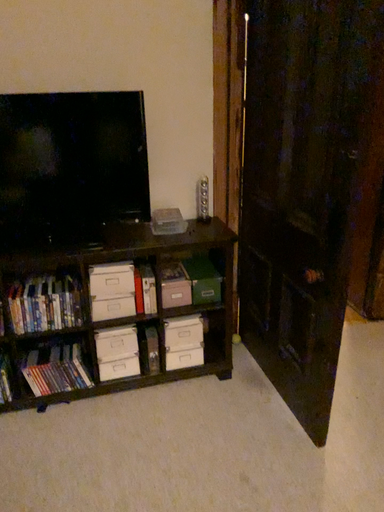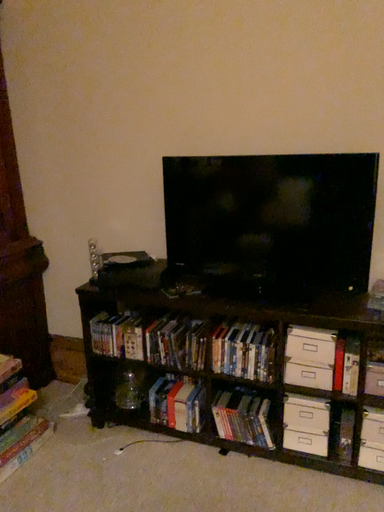
Question: Which way did the camera rotate in the video?

Choices:
 (A) rotated upward
 (B) rotated downward

Answer: (A)